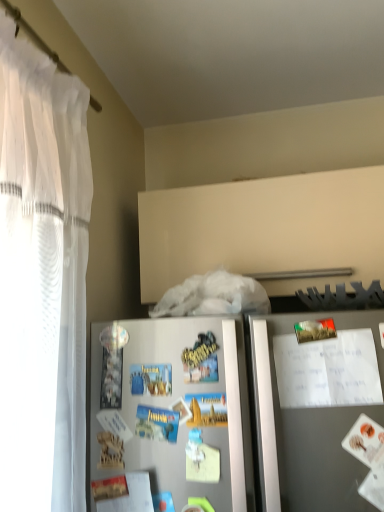
You are a GUI agent. You are given a task and a screenshot of the screen. Output one action in this format:
    pyautogui.click(x=<x>, y=<y>)
    Task: Click on the white paper at upper right
    The width and height of the screenshot is (384, 512).
    Given the screenshot: What is the action you would take?
    pyautogui.click(x=328, y=370)

This screenshot has height=512, width=384. Describe the element at coordinates (328, 370) in the screenshot. I see `white paper at upper right` at that location.

At what (x,y) coordinates should I click in order to perform the action: click on satin silver refrigerator at lower center. Please return your answer as a coordinate pair (x, y). This screenshot has height=512, width=384. Looking at the image, I should click on (175, 412).

Measure the distance between point (131, 353) and camera.

The distance of point (131, 353) from camera is 3.31 feet.

Image resolution: width=384 pixels, height=512 pixels. Describe the element at coordinates (175, 412) in the screenshot. I see `satin silver refrigerator at lower center` at that location.

The image size is (384, 512). What are the coordinates of `white paper at upper right` in the screenshot? It's located at (328, 370).

Which object is positioned more to the right, satin silver refrigerator at lower center or white paper at upper right?

From the viewer's perspective, white paper at upper right appears more on the right side.

In the scene shown: Between satin silver refrigerator at lower center and white paper at upper right, which one is positioned in front?

satin silver refrigerator at lower center is in front.

Is point (200, 428) positioned in front of point (357, 351)?

No, (200, 428) is behind (357, 351).

From the image's perspective, does satin silver refrigerator at lower center appear lower than white paper at upper right?

Yes.

From a real-world perspective, between satin silver refrigerator at lower center and white paper at upper right, who is vertically higher?

From a 3D spatial view, white paper at upper right is above.

Is satin silver refrigerator at lower center wider or thinner than white paper at upper right?

satin silver refrigerator at lower center is thinner than white paper at upper right.

Which of these two, satin silver refrigerator at lower center or white paper at upper right, stands shorter?

With less height is white paper at upper right.

Based on the photo, considering the sizes of satin silver refrigerator at lower center and white paper at upper right in the image, is satin silver refrigerator at lower center bigger or smaller than white paper at upper right?

In the image, satin silver refrigerator at lower center appears to be larger than white paper at upper right.

Based on the photo, does satin silver refrigerator at lower center contain white paper at upper right?

Yes, white paper at upper right is surrounded by satin silver refrigerator at lower center.

Is satin silver refrigerator at lower center next to white paper at upper right?

There is a gap between satin silver refrigerator at lower center and white paper at upper right.

Is satin silver refrigerator at lower center looking in the opposite direction of white paper at upper right?

Yes, white paper at upper right is at the back of satin silver refrigerator at lower center.

How different are the orientations of satin silver refrigerator at lower center and white paper at upper right in degrees?

There is a 1.39-degree angle between the facing directions of satin silver refrigerator at lower center and white paper at upper right.

From the picture: How much distance is there between satin silver refrigerator at lower center and white paper at upper right?

They are 5.65 inches apart.

The image size is (384, 512). Identify the location of comic book that appears above the satin silver refrigerator at lower center (from the image's perspective). (328, 370).

Which object is positioned more to the left, white paper at upper right or satin silver refrigerator at lower center?

Positioned to the left is satin silver refrigerator at lower center.

Is the position of white paper at upper right less distant than that of satin silver refrigerator at lower center?

No, it is behind satin silver refrigerator at lower center.

Between point (363, 350) and point (273, 480), which one is positioned behind?

Positioned behind is point (363, 350).

From the image's perspective, between white paper at upper right and satin silver refrigerator at lower center, which one is located above?

white paper at upper right appears higher in the image.

From a real-world perspective, which object stands above the other?

white paper at upper right is physically above.

In the scene shown: Can you confirm if white paper at upper right is wider than satin silver refrigerator at lower center?

Correct, the width of white paper at upper right exceeds that of satin silver refrigerator at lower center.

Considering the relative sizes of white paper at upper right and satin silver refrigerator at lower center in the image provided, is white paper at upper right shorter than satin silver refrigerator at lower center?

Yes.

Considering the relative sizes of white paper at upper right and satin silver refrigerator at lower center in the image provided, is white paper at upper right bigger than satin silver refrigerator at lower center?

No.

Would you say white paper at upper right is outside satin silver refrigerator at lower center?

No.

Are white paper at upper right and satin silver refrigerator at lower center located far from each other?

No, white paper at upper right is in close proximity to satin silver refrigerator at lower center.

Is white paper at upper right oriented towards satin silver refrigerator at lower center?

Yes, white paper at upper right is turned towards satin silver refrigerator at lower center.

How many degrees apart are the facing directions of white paper at upper right and satin silver refrigerator at lower center?

The angular difference between white paper at upper right and satin silver refrigerator at lower center is 1.39 degrees.

The height and width of the screenshot is (512, 384). I want to click on comic book above the satin silver refrigerator at lower center (from a real-world perspective), so click(328, 370).

You are a GUI agent. You are given a task and a screenshot of the screen. Output one action in this format:
    pyautogui.click(x=<x>, y=<y>)
    Task: Click on the refrigerator that appears on the left of white paper at upper right
    This screenshot has height=512, width=384.
    Given the screenshot: What is the action you would take?
    pyautogui.click(x=175, y=412)

Locate an element on the screen. comic book above the satin silver refrigerator at lower center (from a real-world perspective) is located at coordinates (328, 370).